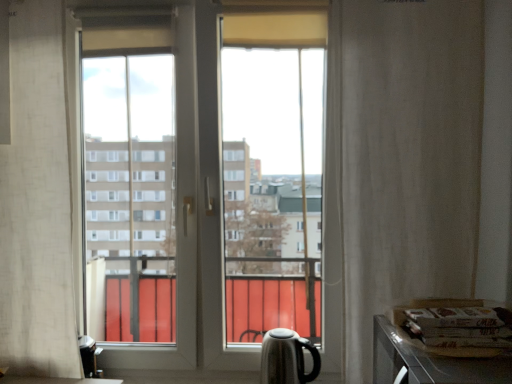
At what (x,y) coordinates should I click in order to perform the action: click on metallic silver counter top at lower right. Please return your answer as a coordinate pair (x, y). Looking at the image, I should click on (429, 362).

Locate an element on the screen. This screenshot has width=512, height=384. transparent glass window at center is located at coordinates (195, 211).

Image resolution: width=512 pixels, height=384 pixels. What do you see at coordinates (195, 211) in the screenshot?
I see `transparent glass window at center` at bounding box center [195, 211].

Describe the element at coordinates (40, 189) in the screenshot. I see `white sheer curtain at left, which is the 2th curtain from right to left` at that location.

How much space does white sheer curtain at left, which is counted as the 1th curtain, starting from the left, occupy vertically?

4.01 feet.

This screenshot has width=512, height=384. In order to click on metallic silver counter top at lower right in this screenshot , I will do `click(429, 362)`.

Is metallic silver counter top at lower right taller or shorter than black glossy kettle at lower right?

Clearly, metallic silver counter top at lower right is taller compared to black glossy kettle at lower right.

Is metallic silver counter top at lower right inside or outside of black glossy kettle at lower right?

metallic silver counter top at lower right is not inside black glossy kettle at lower right, it's outside.

Is metallic silver counter top at lower right turned away from black glossy kettle at lower right?

No, black glossy kettle at lower right is not at the back of metallic silver counter top at lower right.

Which of these two, metallic silver counter top at lower right or black glossy kettle at lower right, is smaller?

With smaller size is black glossy kettle at lower right.

Would you say white sheer curtain at left, which is the 2th curtain from right to left, is outside black glossy kettle at lower right?

Yes, white sheer curtain at left, which is the 2th curtain from right to left, is located beyond the bounds of black glossy kettle at lower right.

Considering the positions of points (77, 257) and (287, 362), is point (77, 257) closer to camera compared to point (287, 362)?

No.

Which is in front, white sheer curtain at left, which is counted as the 1th curtain, starting from the left, or black glossy kettle at lower right?

white sheer curtain at left, which is counted as the 1th curtain, starting from the left, is in front.

From the image's perspective, is white sheer curtain at left, which is counted as the 1th curtain, starting from the left, located beneath black glossy kettle at lower right?

No, from the image's perspective, white sheer curtain at left, which is counted as the 1th curtain, starting from the left, is not below black glossy kettle at lower right.

Which is closer, [16,290] or [394,326]?

The point [394,326] is closer to the camera.

Considering the sizes of objects white sheer curtain at left, which is the 2th curtain from right to left, and metallic silver counter top at lower right in the image provided, who is shorter, white sheer curtain at left, which is the 2th curtain from right to left, or metallic silver counter top at lower right?

metallic silver counter top at lower right is shorter.

From the picture: Which is behind, white sheer curtain at left, which is the 2th curtain from right to left, or metallic silver counter top at lower right?

white sheer curtain at left, which is the 2th curtain from right to left.

From a real-world perspective, which is physically below, white sheer curtain at left, which is counted as the 1th curtain, starting from the left, or metallic silver counter top at lower right?

In real-world perspective, metallic silver counter top at lower right is lower.

Which object is closer to the camera, black glossy kettle at lower right or white sheer curtain at left, which is the 2th curtain from right to left?

white sheer curtain at left, which is the 2th curtain from right to left, is more forward.

Where is `curtain that is on the left side of black glossy kettle at lower right`? Image resolution: width=512 pixels, height=384 pixels. curtain that is on the left side of black glossy kettle at lower right is located at coordinates (40, 189).

From the image's perspective, between black glossy kettle at lower right and white sheer curtain at left, which is counted as the 1th curtain, starting from the left, who is located below?

black glossy kettle at lower right.

Is white textured curtain at right, the 2th curtain positioned from the left, at the right side of black glossy kettle at lower right?

Correct, you'll find white textured curtain at right, the 2th curtain positioned from the left, to the right of black glossy kettle at lower right.

Is white textured curtain at right, which is the first curtain from right to left, completely or partially outside of black glossy kettle at lower right?

Indeed, white textured curtain at right, which is the first curtain from right to left, is completely outside black glossy kettle at lower right.

Is white textured curtain at right, the 2th curtain positioned from the left, positioned before black glossy kettle at lower right?

That is True.

Based on the photo, what's the angular difference between transparent glass window at center and black glossy kettle at lower right's facing directions?

They differ by 0.0454 degrees in their facing directions.

Are transparent glass window at center and black glossy kettle at lower right far apart?

No, transparent glass window at center is in close proximity to black glossy kettle at lower right.

Which of these two, transparent glass window at center or black glossy kettle at lower right, stands shorter?

With less height is black glossy kettle at lower right.

Would you say transparent glass window at center is outside black glossy kettle at lower right?

Indeed, transparent glass window at center is completely outside black glossy kettle at lower right.

From their relative heights in the image, would you say white sheer curtain at left, which is the 2th curtain from right to left, is taller or shorter than white textured curtain at right, the 2th curtain positioned from the left?

In the image, white sheer curtain at left, which is the 2th curtain from right to left, appears to be taller than white textured curtain at right, the 2th curtain positioned from the left.

From the image's perspective, is white sheer curtain at left, which is counted as the 1th curtain, starting from the left, located above white textured curtain at right, which is the first curtain from right to left?

Indeed, from the image's perspective, white sheer curtain at left, which is counted as the 1th curtain, starting from the left, is shown above white textured curtain at right, which is the first curtain from right to left.

From a real-world perspective, is white sheer curtain at left, which is the 2th curtain from right to left, positioned under white textured curtain at right, which is the first curtain from right to left, based on gravity?

Actually, white sheer curtain at left, which is the 2th curtain from right to left, is physically above white textured curtain at right, which is the first curtain from right to left, in the real world.

The width and height of the screenshot is (512, 384). In order to click on tea pot on the left of metallic silver counter top at lower right in this screenshot , I will do `click(286, 358)`.

Locate an element on the screen. This screenshot has height=384, width=512. tea pot below the white sheer curtain at left, which is the 2th curtain from right to left (from a real-world perspective) is located at coordinates pyautogui.click(x=286, y=358).

Based on the photo, considering their positions, is transparent glass window at center positioned closer to metallic silver counter top at lower right than white textured curtain at right, the 2th curtain positioned from the left?

white textured curtain at right, the 2th curtain positioned from the left, is closer to metallic silver counter top at lower right.

Estimate the real-world distances between objects in this image. Which object is closer to white sheer curtain at left, which is counted as the 1th curtain, starting from the left, black glossy kettle at lower right or white textured curtain at right, the 2th curtain positioned from the left?

black glossy kettle at lower right.

Estimate the real-world distances between objects in this image. Which object is further from white sheer curtain at left, which is the 2th curtain from right to left, metallic silver counter top at lower right or white textured curtain at right, the 2th curtain positioned from the left?

The object further to white sheer curtain at left, which is the 2th curtain from right to left, is metallic silver counter top at lower right.

From the image, which object appears to be nearer to white sheer curtain at left, which is counted as the 1th curtain, starting from the left, metallic silver counter top at lower right or black glossy kettle at lower right?

Among the two, black glossy kettle at lower right is located nearer to white sheer curtain at left, which is counted as the 1th curtain, starting from the left.

When comparing their distances from transparent glass window at center, does metallic silver counter top at lower right or black glossy kettle at lower right seem further?

metallic silver counter top at lower right lies further to transparent glass window at center than the other object.

From the image, which object appears to be nearer to transparent glass window at center, black glossy kettle at lower right or white textured curtain at right, the 2th curtain positioned from the left?

black glossy kettle at lower right is positioned closer to the anchor transparent glass window at center.

Looking at the image, which one is located closer to white sheer curtain at left, which is the 2th curtain from right to left, white textured curtain at right, the 2th curtain positioned from the left, or black glossy kettle at lower right?

Among the two, black glossy kettle at lower right is located nearer to white sheer curtain at left, which is the 2th curtain from right to left.

Looking at the image, which one is located further to black glossy kettle at lower right, white textured curtain at right, the 2th curtain positioned from the left, or metallic silver counter top at lower right?

Based on the image, white textured curtain at right, the 2th curtain positioned from the left, appears to be further to black glossy kettle at lower right.

You are a GUI agent. You are given a task and a screenshot of the screen. Output one action in this format:
    pyautogui.click(x=<x>, y=<y>)
    Task: Click on the bay window between white textured curtain at right, the 2th curtain positioned from the left, and black glossy kettle at lower right in the up-down direction
    
    Given the screenshot: What is the action you would take?
    pyautogui.click(x=195, y=211)

Find the location of `bay window between white sheer curtain at left, which is counted as the 1th curtain, starting from the left, and metallic silver counter top at lower right from left to right`. bay window between white sheer curtain at left, which is counted as the 1th curtain, starting from the left, and metallic silver counter top at lower right from left to right is located at coordinates (195, 211).

Find the location of a particular element. curtain located between transparent glass window at center and metallic silver counter top at lower right in the left-right direction is located at coordinates (399, 162).

Locate an element on the screen. The height and width of the screenshot is (384, 512). bay window between white sheer curtain at left, which is counted as the 1th curtain, starting from the left, and black glossy kettle at lower right is located at coordinates (195, 211).